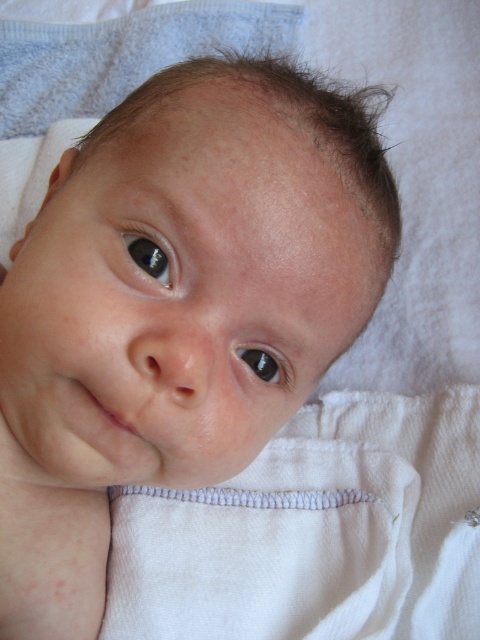
Based on the photo, you are a photographer taking a close up of a baby. You want to focus on the black glossy eye at upper left. Where exactly should you aim your camera lens?

You should aim your camera lens at point (148, 257) to focus on the black glossy eye at upper left.

You are a photographer taking a close up of a baby. You notice a point at coordinate (148, 257). What object is located at that coordinate?

The point at coordinate (148, 257) indicates the black glossy eye at upper left.